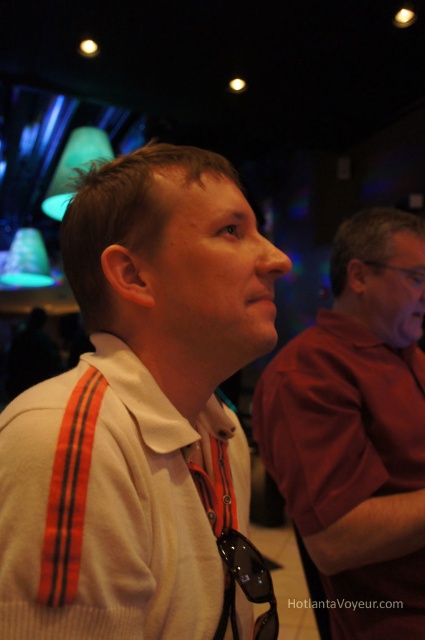
Question: Which object appears farthest from the camera in this image?

Choices:
 (A) white matte shirt at center
 (B) white knit sweater at center

Answer: (A)

Question: Is white knit sweater at center in front of white matte shirt at center?

Choices:
 (A) no
 (B) yes

Answer: (B)

Question: Which of the following is the closest to the observer?

Choices:
 (A) white matte shirt at center
 (B) white knit sweater at center

Answer: (B)

Question: Is white knit sweater at center closer to the viewer compared to white matte shirt at center?

Choices:
 (A) no
 (B) yes

Answer: (B)

Question: Is white knit sweater at center above white matte shirt at center?

Choices:
 (A) yes
 (B) no

Answer: (A)

Question: Among these objects, which one is farthest from the camera?

Choices:
 (A) white knit sweater at center
 (B) white matte shirt at center

Answer: (B)